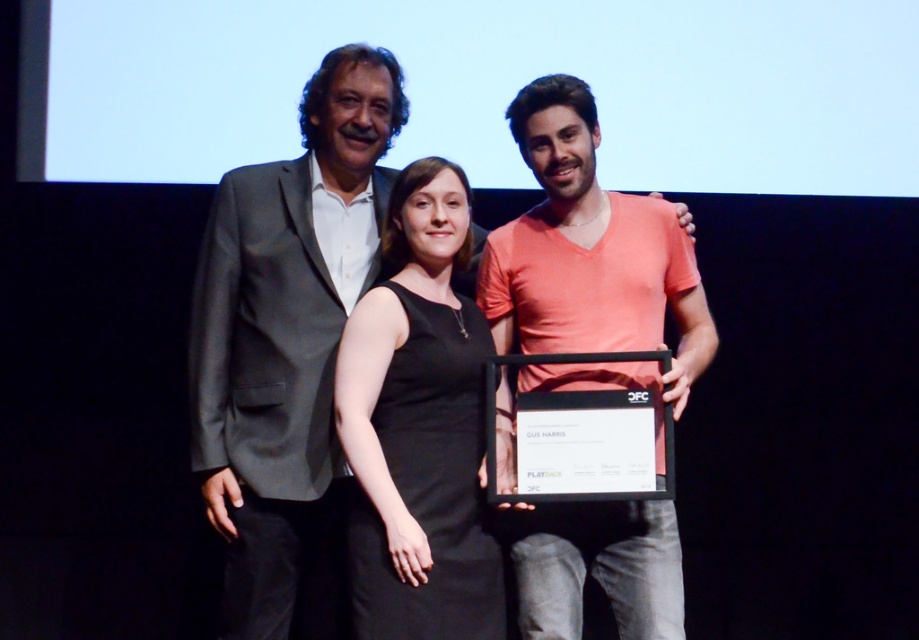
Is matte orange t-shirt at center above black dress at center?

Correct, matte orange t-shirt at center is located above black dress at center.

Which of these two, matte orange t-shirt at center or black dress at center, stands shorter?

With less height is black dress at center.

Is point (509, 308) behind point (426, 493)?

Yes.

Locate an element on the screen. The height and width of the screenshot is (640, 919). matte orange t-shirt at center is located at coordinates (588, 250).

Does matte gray suit at center have a larger size compared to black dress at center?

Yes.

Is matte gray suit at center in front of black dress at center?

No, matte gray suit at center is behind black dress at center.

Image resolution: width=919 pixels, height=640 pixels. I want to click on matte gray suit at center, so click(288, 348).

Between matte gray suit at center and matte orange t-shirt at center, which one appears on the right side from the viewer's perspective?

matte orange t-shirt at center

Is matte gray suit at center to the right of matte orange t-shirt at center from the viewer's perspective?

Incorrect, matte gray suit at center is not on the right side of matte orange t-shirt at center.

Who is more forward, (234, 186) or (552, 74)?

Point (552, 74) is more forward.

This screenshot has height=640, width=919. What are the coordinates of `matte gray suit at center` in the screenshot? It's located at (288, 348).